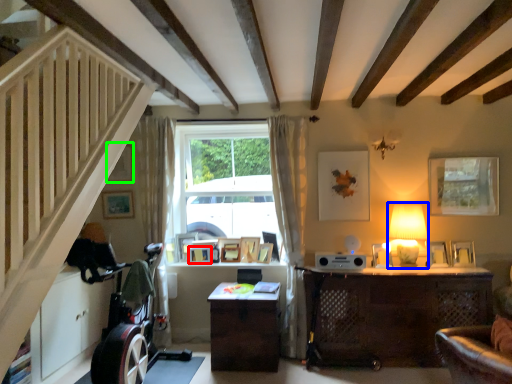
Question: Which is nearer to the picture frame (highlighted by a red box)? table lamp (highlighted by a blue box) or picture frame (highlighted by a green box).

Choices:
 (A) table lamp
 (B) picture frame

Answer: (B)